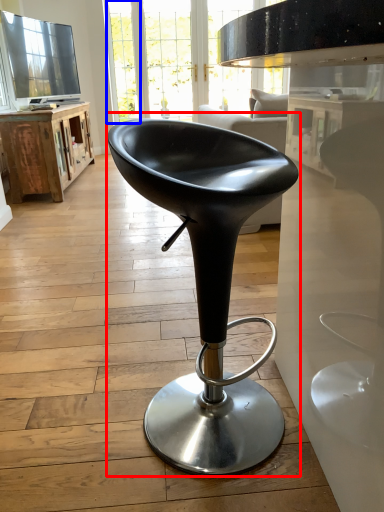
Question: Which of the following is the closest to the observer, chair (highlighted by a red box) or glass door (highlighted by a blue box)?

Choices:
 (A) chair
 (B) glass door

Answer: (A)